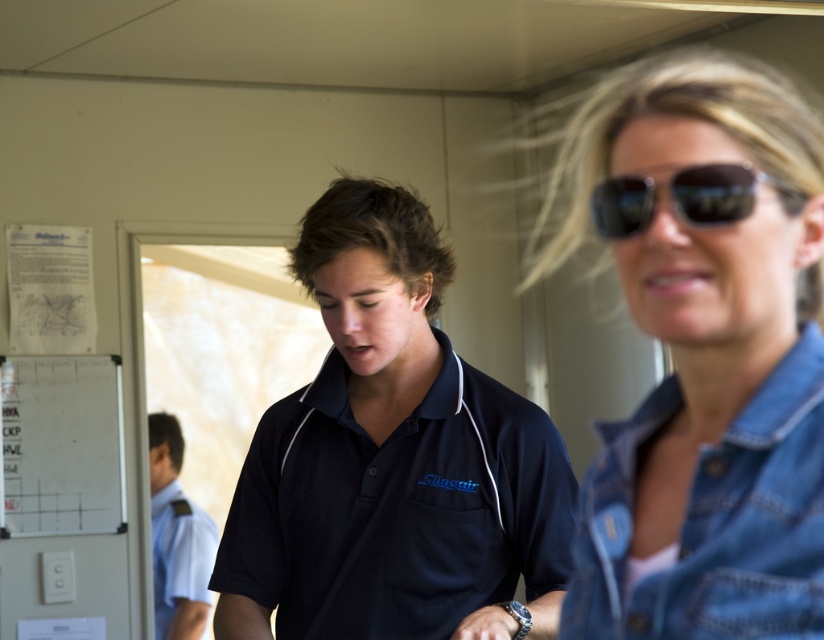
Question: Does denim jacket at upper right have a lesser width compared to light blue uniform at lower left?

Choices:
 (A) no
 (B) yes

Answer: (A)

Question: Is denim jacket at lower right above black reflective sunglasses at upper right?

Choices:
 (A) no
 (B) yes

Answer: (A)

Question: Does black cotton polo shirt at center have a larger size compared to black reflective sunglasses at upper right?

Choices:
 (A) no
 (B) yes

Answer: (B)

Question: Which point is farther from the camera taking this photo?

Choices:
 (A) (765, 424)
 (B) (153, 442)
 (C) (729, 552)
 (D) (776, 180)

Answer: (B)

Question: Which point is farther to the camera?

Choices:
 (A) denim jacket at lower right
 (B) denim jacket at upper right

Answer: (B)

Question: Which point is closer to the camera taking this photo?

Choices:
 (A) (438, 608)
 (B) (649, 602)

Answer: (B)